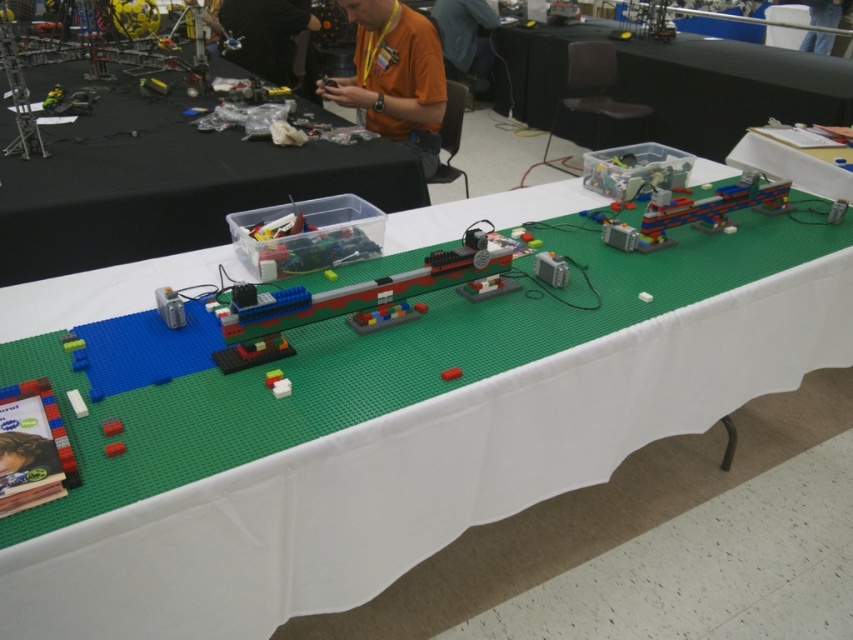
You are a participant at a LEGO competition and notice the green plastic table at upper center and the orange shirt at upper center in the image. Which object is positioned higher from the ground?

The orange shirt at upper center is higher from the ground because the green plastic table at upper center is below it.

Based on the photo, you are a participant at the LEGO event and need to locate the green plastic table at upper center. From your perspective, which side of the orange shirt at upper center should you look towards to find it?

The green plastic table at upper center is positioned on the right side of the orange shirt at upper center, so you should look to the right of the orange shirt at upper center to find it.